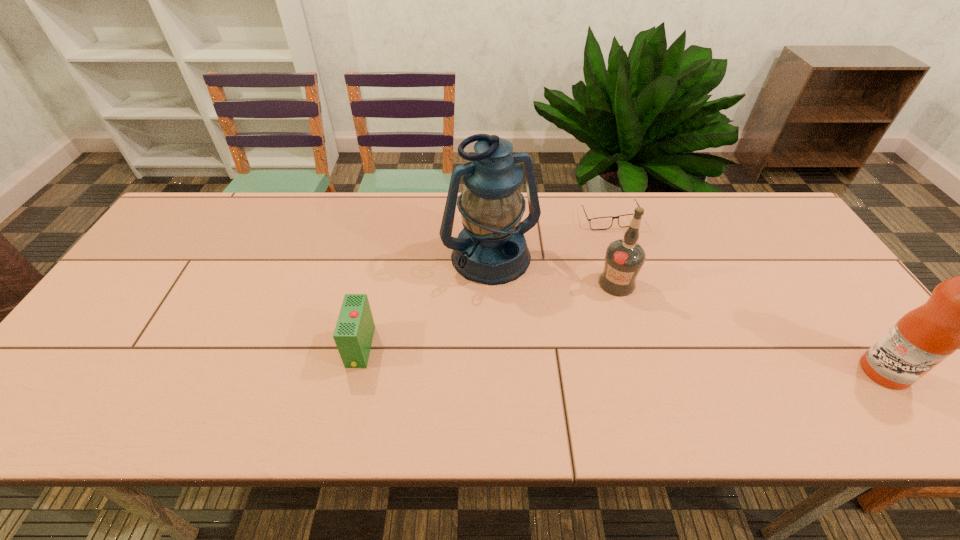
In the image, there is a desktop. Where is `vacant space at the right edge`? Image resolution: width=960 pixels, height=540 pixels. vacant space at the right edge is located at coordinates (800, 253).

At what (x,y) coordinates should I click in order to perform the action: click on vacant area at the far left corner of the desktop. Please return your answer as a coordinate pair (x, y). Looking at the image, I should click on (225, 195).

Where is `free space at the far right corner of the desktop`? The width and height of the screenshot is (960, 540). free space at the far right corner of the desktop is located at coordinates point(742,197).

At what (x,y) coordinates should I click in order to perform the action: click on vacant space that's between the lantern and the spectacles. Please return your answer as a coordinate pair (x, y). The width and height of the screenshot is (960, 540). Looking at the image, I should click on (550, 240).

Identify the location of vacant space that is in between the fourth shortest object and the alarm clock. This screenshot has height=540, width=960. (622, 360).

The image size is (960, 540). I want to click on free spot between the lantern and the fruit juice, so click(x=687, y=315).

The height and width of the screenshot is (540, 960). Find the location of `free spot between the second shortest object and the vodka`. free spot between the second shortest object and the vodka is located at coordinates (489, 315).

The height and width of the screenshot is (540, 960). Find the location of `vacant area between the fruit juice and the spectacles`. vacant area between the fruit juice and the spectacles is located at coordinates (747, 295).

The image size is (960, 540). In order to click on vacant point located between the third shortest object and the leftmost object in this screenshot , I will do `click(489, 315)`.

I want to click on vacant space in between the second tallest object and the vodka, so coord(751,327).